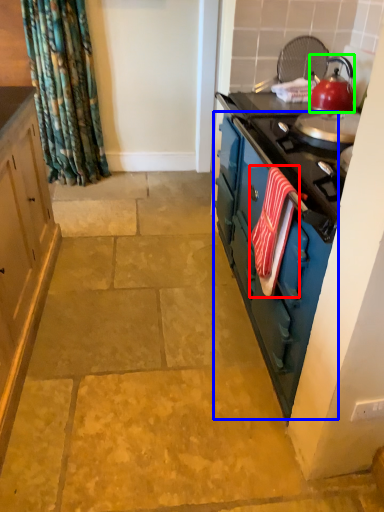
Question: Which is nearer to the beach towel (highlighted by a red box)? dresser (highlighted by a blue box) or kitchen appliance (highlighted by a green box).

Choices:
 (A) dresser
 (B) kitchen appliance

Answer: (A)